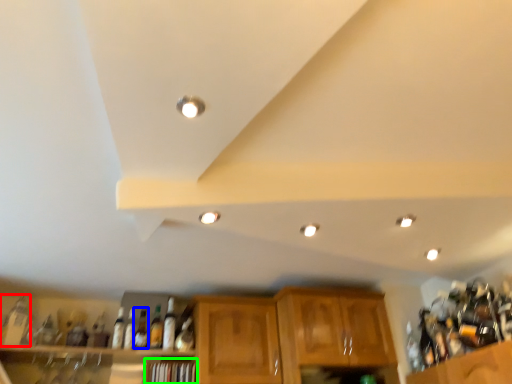
Question: Which is farther away from bottle (highlighted by a red box)? bottle (highlighted by a blue box) or shelf (highlighted by a green box)?

Choices:
 (A) bottle
 (B) shelf

Answer: (B)